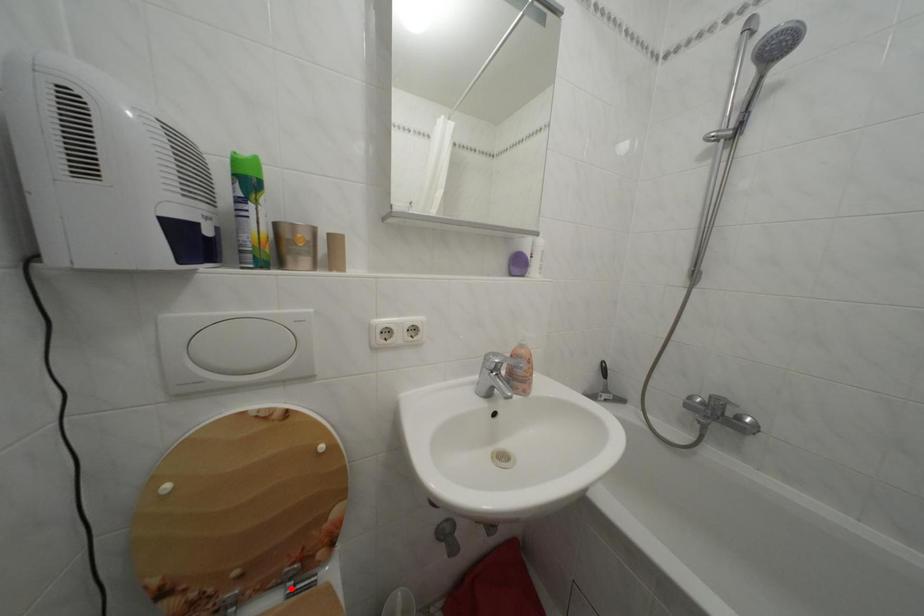
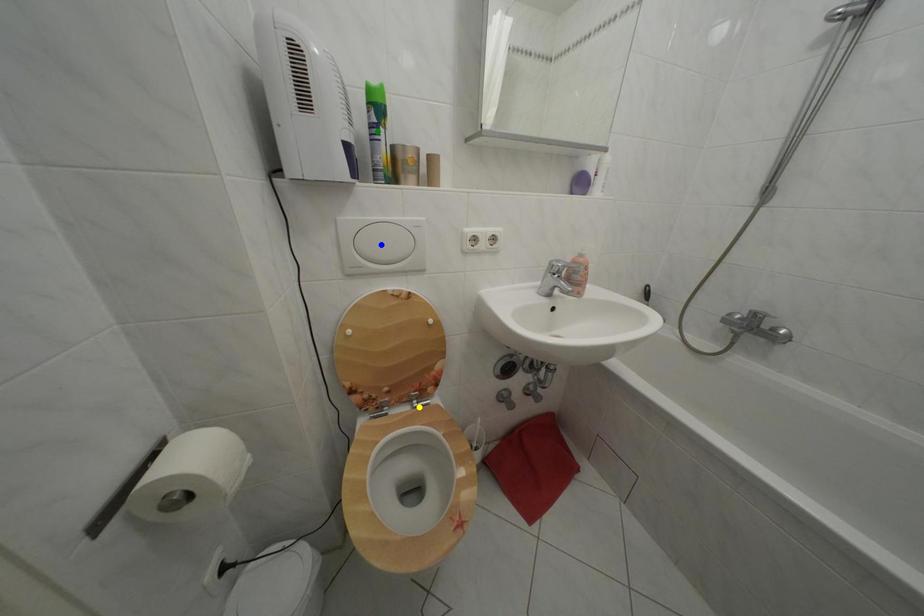
Question: I am providing you with two images of the same scene from different viewpoints. A red point is marked on the first image. You are given multiple points on the second image. In image 2, which mark is for the same physical point as the one in image 1?

Choices:
 (A) green point
 (B) yellow point
 (C) blue point

Answer: (B)